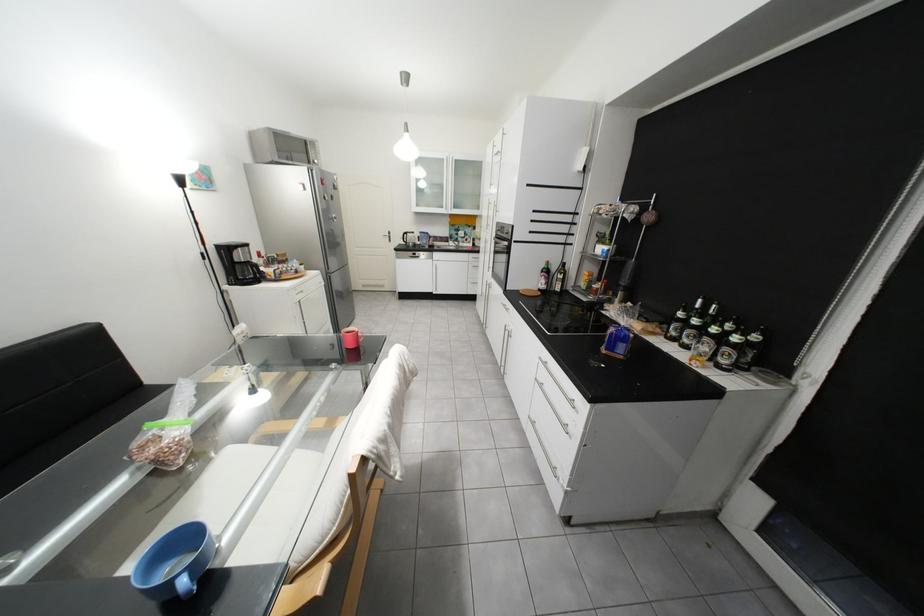
Describe the element at coordinates (386, 236) in the screenshot. I see `a silver door handle` at that location.